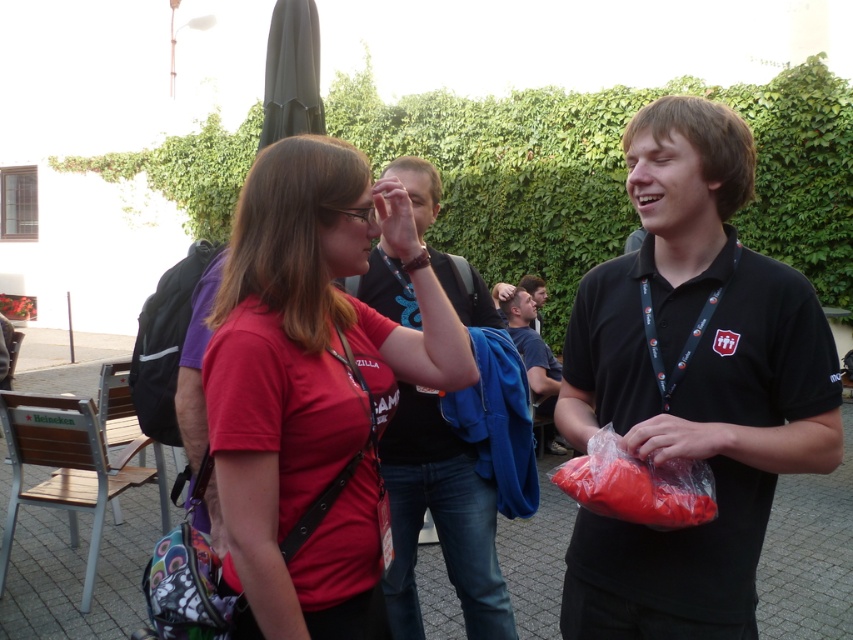
You are a photographer at the event and want to capture a clear shot of both the black matte shirt at center and the translucent plastic bag at center. Since you want both to be visible, which object should you focus on first to ensure depth of field?

The black matte shirt at center is taller than the translucent plastic bag at center, so focusing on the black matte shirt at center first will ensure both are within the depth of field.

From the picture: You are at a gathering in a courtyard with ivy walls. You see a black matte shirt at center and a translucent plastic bag at center. Which object is closer to you?

The black matte shirt at center is closer because the translucent plastic bag at center is behind it.